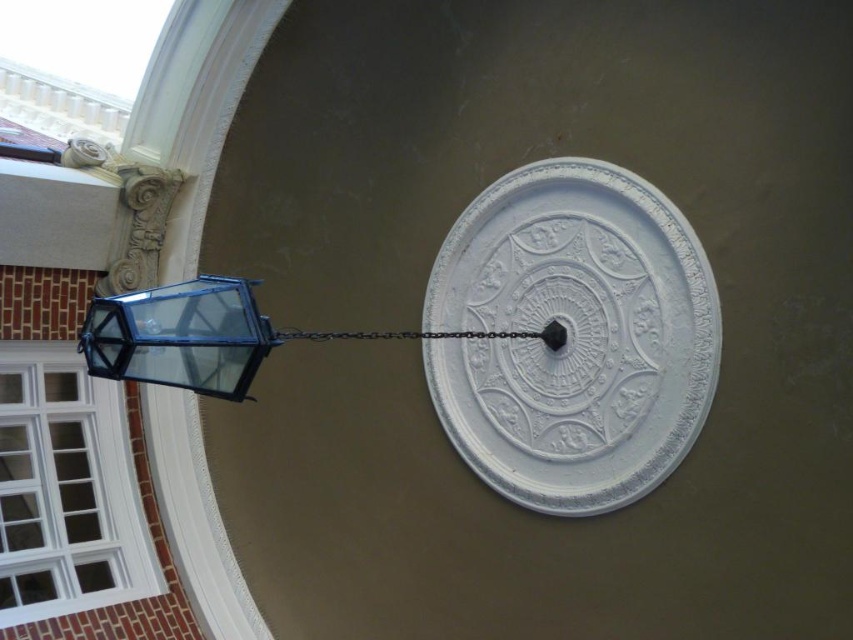
Which is behind, point (526, 499) or point (200, 326)?

The point (526, 499) is behind.

Between white textured clock at center and matte glass lantern at left, which one has more height?

Standing taller between the two is white textured clock at center.

The width and height of the screenshot is (853, 640). Describe the element at coordinates (572, 337) in the screenshot. I see `white textured clock at center` at that location.

You are a GUI agent. You are given a task and a screenshot of the screen. Output one action in this format:
    pyautogui.click(x=<x>, y=<y>)
    Task: Click on the white textured clock at center
    The height and width of the screenshot is (640, 853).
    Given the screenshot: What is the action you would take?
    pyautogui.click(x=572, y=337)

Does blue glass lantern at upper left have a greater height compared to black metal chain at center?

Yes.

Does blue glass lantern at upper left have a smaller size compared to black metal chain at center?

No, blue glass lantern at upper left is not smaller than black metal chain at center.

Is point (142, 346) positioned in front of point (293, 339)?

Yes, point (142, 346) is closer to viewer.

The image size is (853, 640). I want to click on blue glass lantern at upper left, so click(213, 337).

Which is behind, point (120, 356) or point (215, 360)?

The point (215, 360) is more distant.

Between point (108, 355) and point (134, 358), which one is positioned behind?

Point (134, 358)

The image size is (853, 640). What are the coordinates of `blue glass lantern at upper left` in the screenshot? It's located at (213, 337).